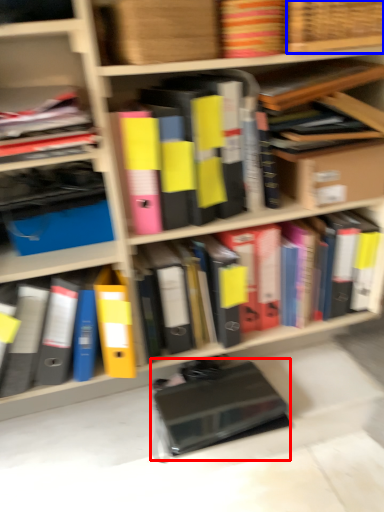
Question: Which object is closer to the camera taking this photo, paperback book (highlighted by a red box) or basket (highlighted by a blue box)?

Choices:
 (A) paperback book
 (B) basket

Answer: (B)